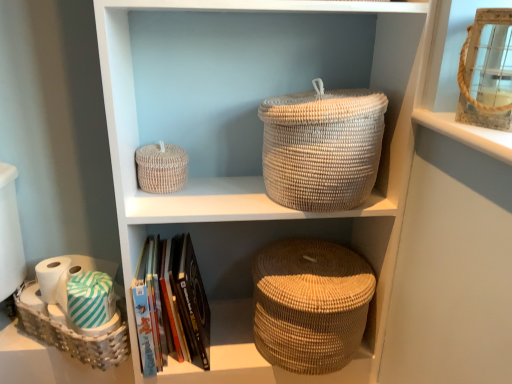
Question: Is natural woven basket at center in contact with woven beige basket at upper left, the 2th basket positioned from the left?

Choices:
 (A) no
 (B) yes

Answer: (A)

Question: Can you confirm if natural woven basket at center is thinner than woven beige basket at upper left, acting as the second basket starting from the top?

Choices:
 (A) no
 (B) yes

Answer: (A)

Question: Would you say natural woven basket at center contains woven beige basket at upper left, which is the 2th basket from bottom to top?

Choices:
 (A) yes
 (B) no

Answer: (A)

Question: From the image's perspective, is natural woven basket at center on woven beige basket at upper left, which is the 2th basket from bottom to top?

Choices:
 (A) no
 (B) yes

Answer: (A)

Question: Can you confirm if natural woven basket at center is bigger than woven beige basket at upper left, which is the 2th basket from bottom to top?

Choices:
 (A) yes
 (B) no

Answer: (A)

Question: Based on their positions, is white woven basket at lower left, the first basket positioned from the bottom, located to the left or right of green striped fabric at lower left, which appears as the 1th toilet paper when viewed from the right?

Choices:
 (A) right
 (B) left

Answer: (B)

Question: Is white woven basket at lower left, acting as the third basket starting from the top, situated inside green striped fabric at lower left, which appears as the 1th toilet paper when viewed from the right, or outside?

Choices:
 (A) outside
 (B) inside

Answer: (A)

Question: Does point (31, 307) appear closer or farther from the camera than point (74, 317)?

Choices:
 (A) closer
 (B) farther

Answer: (B)

Question: Is white woven basket at lower left, placed as the 3th basket when sorted from right to left, in front of or behind green striped fabric at lower left, which appears as the second toilet paper when viewed from the left, in the image?

Choices:
 (A) behind
 (B) front

Answer: (B)

Question: Considering their positions, is woven beige basket at upper left, acting as the 2th basket starting from the right, located in front of or behind green striped fabric at lower left, which appears as the second toilet paper when viewed from the left?

Choices:
 (A) behind
 (B) front

Answer: (A)

Question: Does point click(x=166, y=153) appear closer or farther from the camera than point click(x=75, y=279)?

Choices:
 (A) closer
 (B) farther

Answer: (A)

Question: Is woven beige basket at upper left, acting as the 2th basket starting from the right, taller or shorter than green striped fabric at lower left, which appears as the 1th toilet paper when viewed from the right?

Choices:
 (A) short
 (B) tall

Answer: (B)

Question: Is woven beige basket at upper left, which is the 2th basket from bottom to top, to the left or to the right of green striped fabric at lower left, which appears as the second toilet paper when viewed from the left, in the image?

Choices:
 (A) right
 (B) left

Answer: (A)

Question: From the image's perspective, is green striped fabric at lower left, which appears as the second toilet paper when viewed from the left, located above or below natural woven basket at center?

Choices:
 (A) above
 (B) below

Answer: (B)

Question: Considering the positions of green striped fabric at lower left, which appears as the second toilet paper when viewed from the left, and natural woven basket at center in the image, is green striped fabric at lower left, which appears as the second toilet paper when viewed from the left, taller or shorter than natural woven basket at center?

Choices:
 (A) tall
 (B) short

Answer: (B)